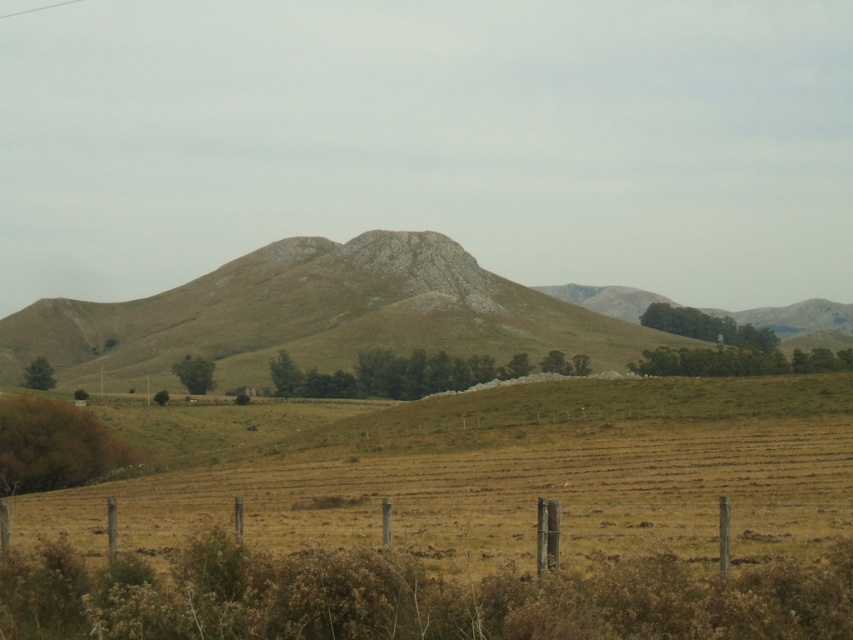
From the picture: You are standing in the middle of the dry grassland at center and want to reach the rugged brown mountain at center. Which direction should you move to get closer to the mountain?

The dry grassland at center is positioned under rugged brown mountain at center, so you should move upward to get closer to the rugged brown mountain at center.